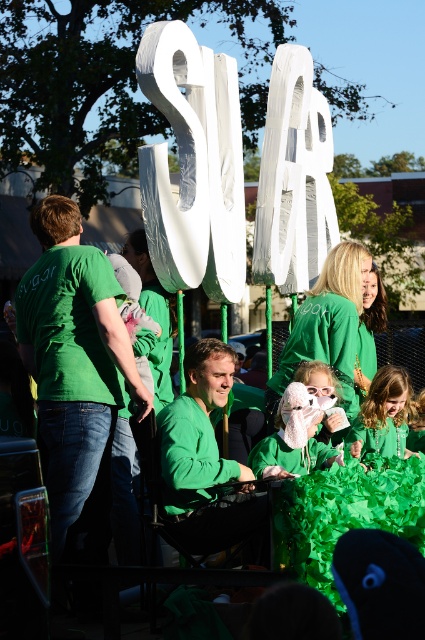
Does green cotton shirt at left appear under white plush toy at center?

No, green cotton shirt at left is not below white plush toy at center.

The height and width of the screenshot is (640, 425). What do you see at coordinates (73, 356) in the screenshot? I see `green cotton shirt at left` at bounding box center [73, 356].

At what (x,y) coordinates should I click in order to perform the action: click on green cotton shirt at left. Please return your answer as a coordinate pair (x, y). Looking at the image, I should click on (73, 356).

Between point (289, 340) and point (323, 369), which one is positioned behind?

The point (289, 340) is more distant.

What do you see at coordinates (326, 324) in the screenshot?
I see `green matte shirt at center` at bounding box center [326, 324].

Locate an element on the screen. Image resolution: width=425 pixels, height=640 pixels. green matte shirt at center is located at coordinates (326, 324).

What are the coordinates of `green matte shirt at center` in the screenshot? It's located at (326, 324).

Is point (311, 404) less distant than point (373, 416)?

Yes, it is.

Does white fluffy hat at center have a lesser width compared to matte green sweater at center?

Yes.

Is point (323, 445) positioned behind point (368, 428)?

That is False.

Locate an element on the screen. white fluffy hat at center is located at coordinates (292, 436).